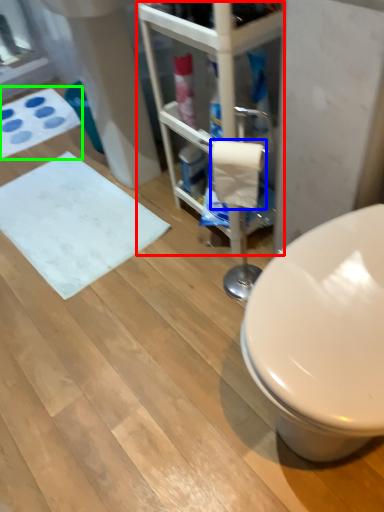
Question: Which object is the closest to the shelf (highlighted by a red box)? Choose among these: toilet paper (highlighted by a blue box) or bath mat (highlighted by a green box).

Choices:
 (A) toilet paper
 (B) bath mat

Answer: (A)